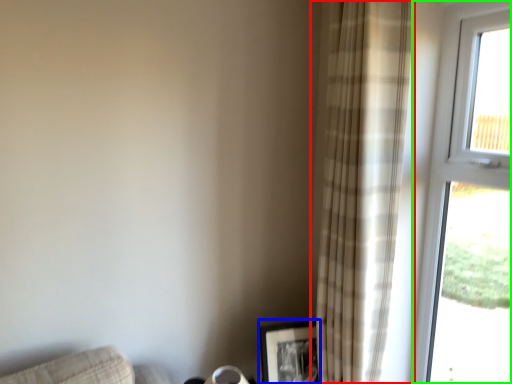
Question: Which object is positioned farthest from curtain (highlighted by a red box)? Select from picture frame (highlighted by a blue box) and window (highlighted by a green box).

Choices:
 (A) picture frame
 (B) window

Answer: (A)